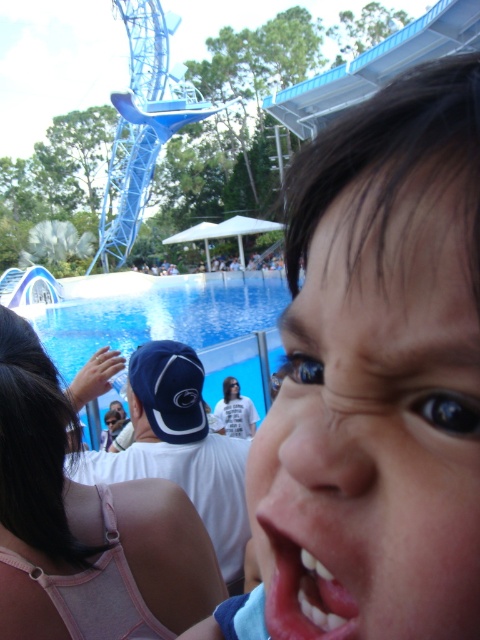
Who is positioned more to the left, transparent glass pool at center or pink glossy lips at center?

transparent glass pool at center is more to the left.

Does point (166, 301) come behind point (269, 529)?

That is True.

Locate an element on the screen. transparent glass pool at center is located at coordinates (168, 321).

Which is below, pink fabric at center or pink glossy lips at center?

pink glossy lips at center is below.

Image resolution: width=480 pixels, height=640 pixels. What do you see at coordinates (91, 502) in the screenshot?
I see `pink fabric at center` at bounding box center [91, 502].

Is point (45, 401) behind point (276, 577)?

That is True.

Find the location of a particular element. pink fabric at center is located at coordinates [x=91, y=502].

Can you confirm if smooth skin face at center is thinner than transparent glass pool at center?

Indeed, smooth skin face at center has a lesser width compared to transparent glass pool at center.

Can you confirm if smooth skin face at center is wider than transparent glass pool at center?

No, smooth skin face at center is not wider than transparent glass pool at center.

Does point (471, 614) lie behind point (101, 298)?

No, it is not.

The width and height of the screenshot is (480, 640). Find the location of `smooth skin face at center`. smooth skin face at center is located at coordinates (375, 424).